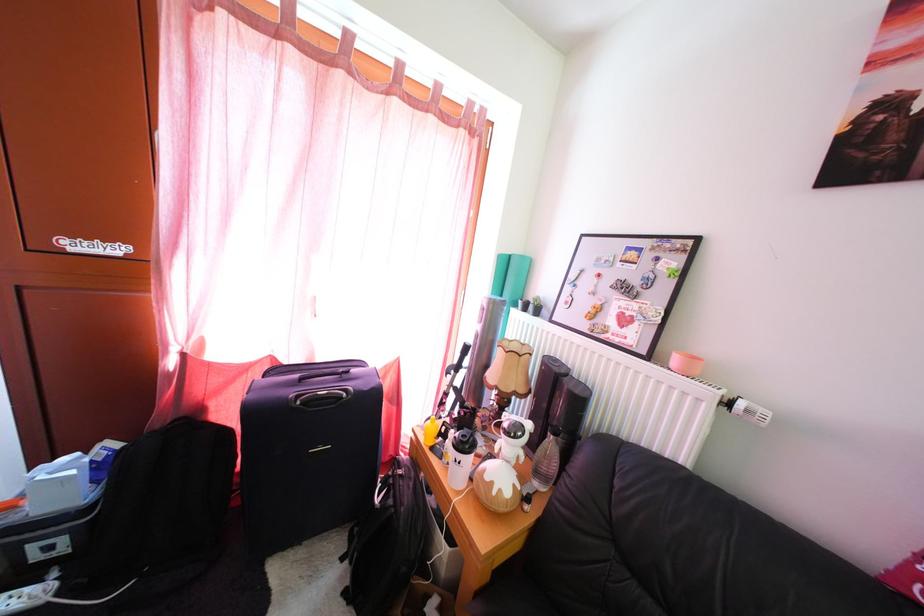
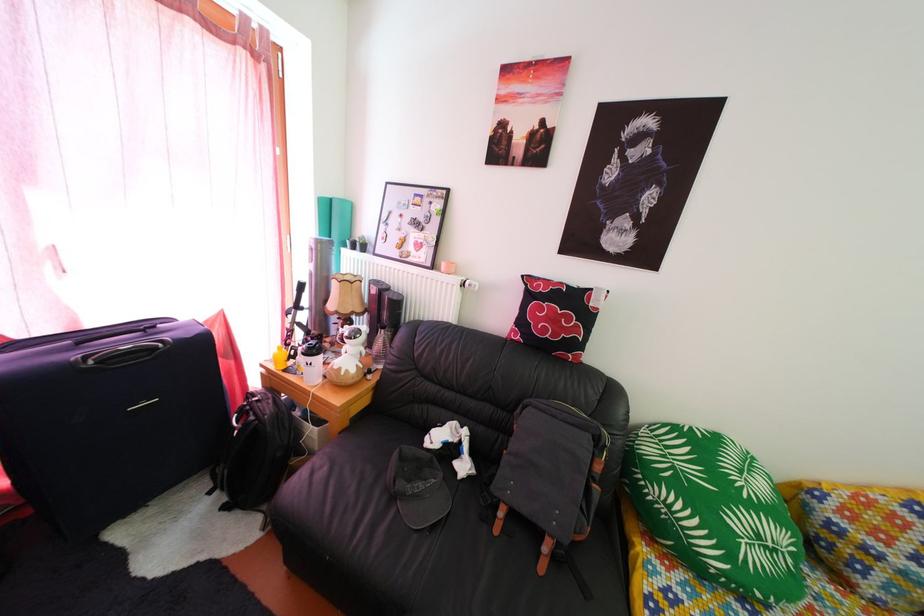
Locate, in the second image, the point that corresponds to point 518,265 in the first image.

(339, 208)